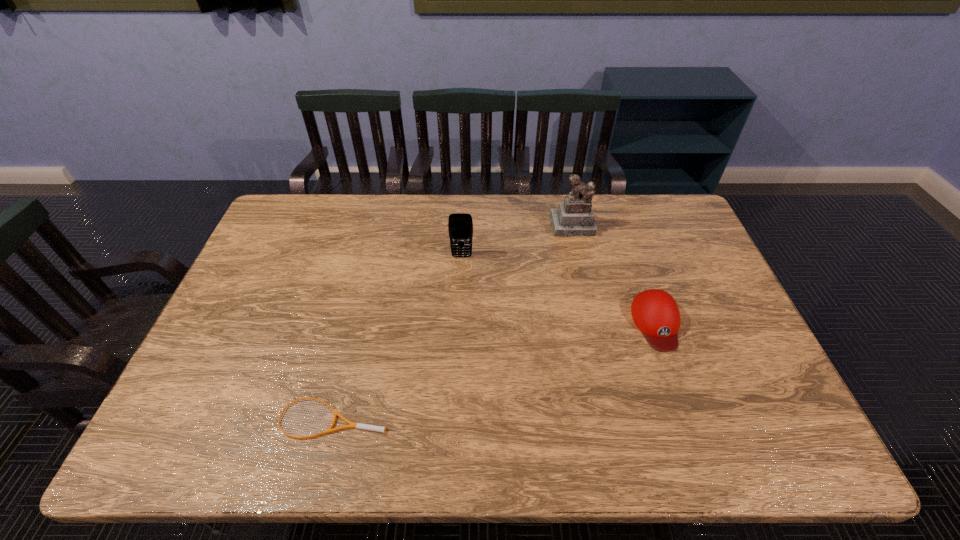
Image resolution: width=960 pixels, height=540 pixels. Find the location of `empty space that is in between the figurine and the leftmost object`. empty space that is in between the figurine and the leftmost object is located at coordinates (454, 322).

Identify the location of vacant area between the second tallest object and the second shortest object. (559, 290).

The height and width of the screenshot is (540, 960). In order to click on vacant area between the rightmost object and the third object from right to left in this screenshot , I will do `click(559, 290)`.

This screenshot has height=540, width=960. Find the location of `vacant space that is in between the tennis racket and the third shortest object`. vacant space that is in between the tennis racket and the third shortest object is located at coordinates [x=398, y=337].

This screenshot has height=540, width=960. I want to click on free spot between the tallest object and the leftmost object, so click(454, 322).

Identify the location of free spot between the cellular telephone and the leftmost object. This screenshot has width=960, height=540. (398, 337).

The width and height of the screenshot is (960, 540). I want to click on empty location between the tennis racket and the third tallest object, so click(495, 371).

Identify the location of free spot between the cellular telephone and the tallest object. (517, 241).

This screenshot has height=540, width=960. What are the coordinates of `free space between the tallest object and the baseball cap` in the screenshot? It's located at (614, 275).

This screenshot has height=540, width=960. What are the coordinates of `object that can be found as the closest to the nearest object` in the screenshot? It's located at 460,225.